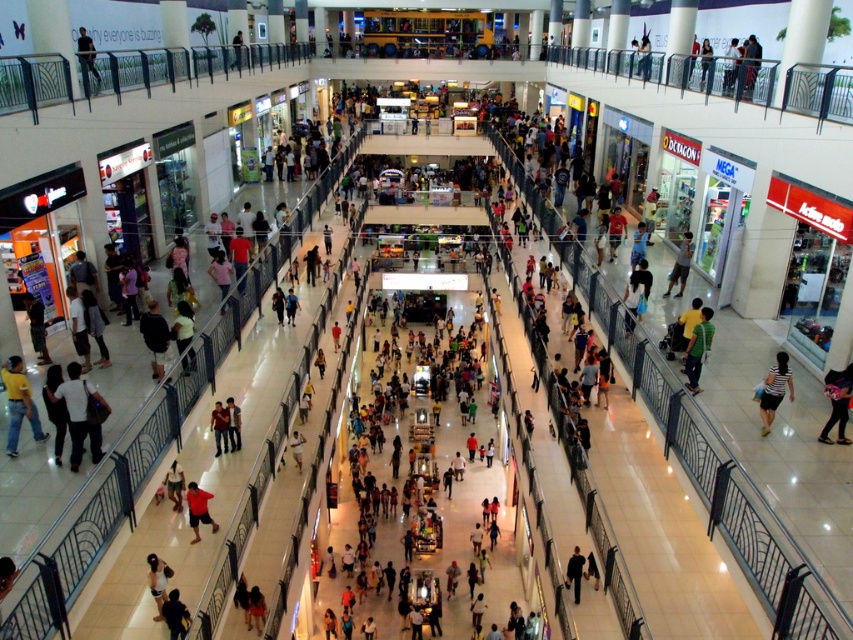
How much distance is there between yellow t-shirt at lower left and dark blue jacket at center?

yellow t-shirt at lower left is 12.19 meters away from dark blue jacket at center.

Who is shorter, yellow t-shirt at lower left or dark blue jacket at center?

Standing shorter between the two is dark blue jacket at center.

Between point (13, 420) and point (572, 564), which one is positioned in front?

Positioned in front is point (13, 420).

This screenshot has height=640, width=853. In order to click on yellow t-shirt at lower left in this screenshot , I will do `click(19, 404)`.

Which is more to the left, striped fabric skirt at center or light blue denim jeans at center?

striped fabric skirt at center

Does striped fabric skirt at center appear on the left side of light blue denim jeans at center?

Yes, striped fabric skirt at center is to the left of light blue denim jeans at center.

Image resolution: width=853 pixels, height=640 pixels. What are the coordinates of `striped fabric skirt at center` in the screenshot? It's located at (775, 390).

Does red cotton shirt at center appear over dark blue jacket at center?

Correct, red cotton shirt at center is located above dark blue jacket at center.

Is point (194, 515) behind point (575, 586)?

No, it is in front of (575, 586).

Image resolution: width=853 pixels, height=640 pixels. In order to click on red cotton shirt at center in this screenshot , I will do `click(198, 509)`.